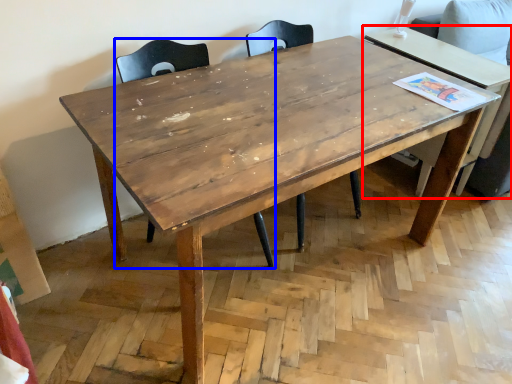
Question: Which object is further to the camera taking this photo, table (highlighted by a red box) or chair (highlighted by a blue box)?

Choices:
 (A) table
 (B) chair

Answer: (A)